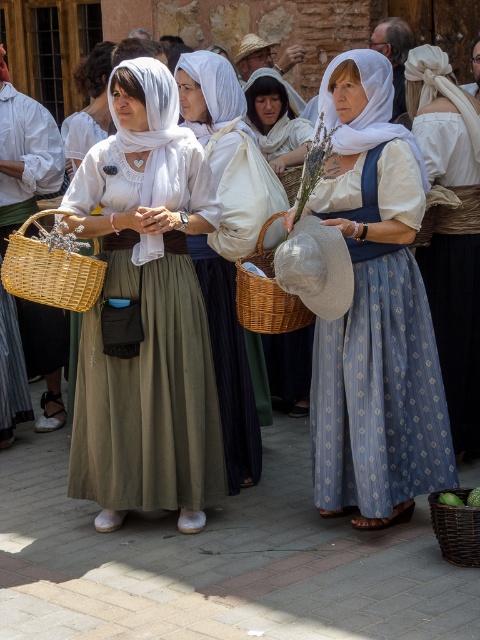
Question: Among these points, which one is nearest to the camera?

Choices:
 (A) (x=299, y=176)
 (B) (x=402, y=490)

Answer: (B)

Question: Considering the relative positions of woven wicker basket at center and woven wicker basket at lower right in the image provided, where is woven wicker basket at center located with respect to woven wicker basket at lower right?

Choices:
 (A) left
 (B) right

Answer: (A)

Question: Can you confirm if blue textured dress at center is thinner than woven wicker basket at left?

Choices:
 (A) no
 (B) yes

Answer: (B)

Question: Which of the following is the farthest from the observer?

Choices:
 (A) woven wicker basket at left
 (B) matte white blouse at center

Answer: (B)

Question: Considering the real-world distances, which object is farthest from the matte white cloth at center?

Choices:
 (A) woven wicker basket at center
 (B) matte white scarf at center
 (C) woven wicker basket at lower right

Answer: (C)

Question: Is blue printed dress at center bigger than matte white cloth at center?

Choices:
 (A) yes
 (B) no

Answer: (A)